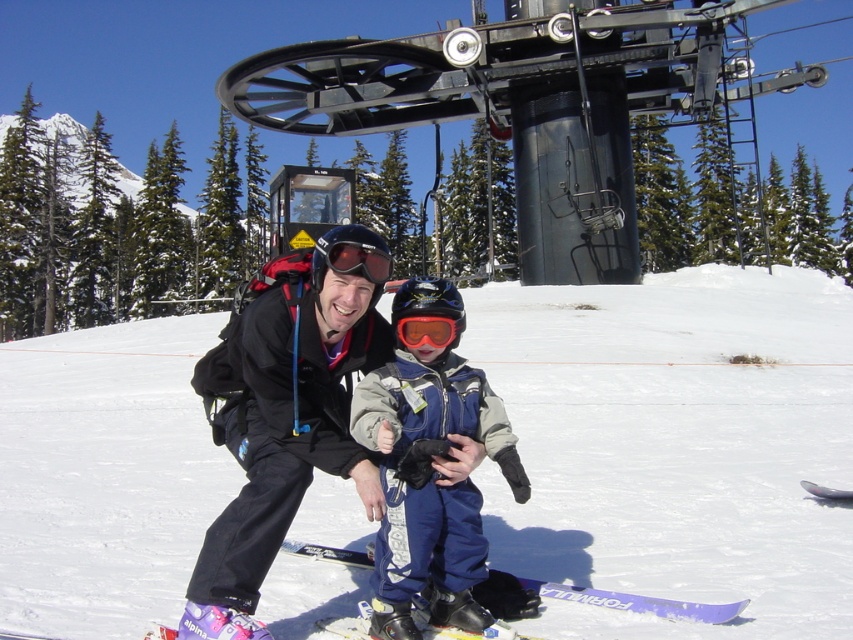
Can you confirm if blue plastic ski at lower center is thinner than orange reflective goggles at center?

No, blue plastic ski at lower center is not thinner than orange reflective goggles at center.

How much distance is there between blue plastic ski at lower center and orange reflective goggles at center?

2.20 meters

Measure the distance between blue plastic ski at lower center and camera.

blue plastic ski at lower center is 5.18 meters away from camera.

This screenshot has width=853, height=640. Identify the location of blue plastic ski at lower center. (639, 602).

Does white powder snow at center have a greater height compared to matte black jacket at center?

Indeed, white powder snow at center has a greater height compared to matte black jacket at center.

Which is above, white powder snow at center or matte black jacket at center?

white powder snow at center is above.

Is point (780, 310) farther from camera compared to point (312, 332)?

Yes, it is behind point (312, 332).

Where is `white powder snow at center`? The width and height of the screenshot is (853, 640). white powder snow at center is located at coordinates (675, 445).

This screenshot has width=853, height=640. What do you see at coordinates (280, 424) in the screenshot?
I see `matte black jacket at center` at bounding box center [280, 424].

Is point (258, 532) more distant than point (494, 435)?

No.

The image size is (853, 640). What are the coordinates of `matte black jacket at center` in the screenshot? It's located at (280, 424).